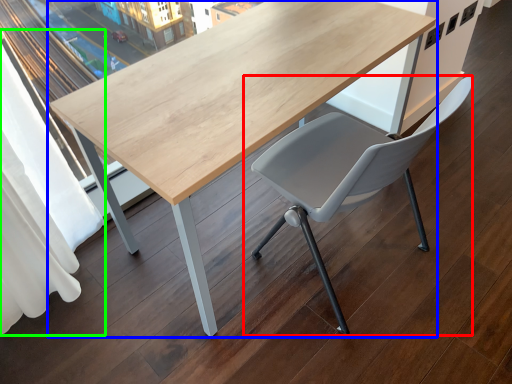
Question: Which object is the closest to the chair (highlighted by a red box)? Choose among these: table (highlighted by a blue box) or curtain (highlighted by a green box).

Choices:
 (A) table
 (B) curtain

Answer: (A)